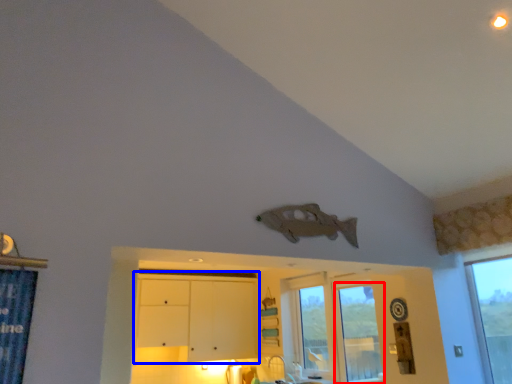
Question: Which object appears closest to the camera in this image, window (highlighted by a red box) or dresser (highlighted by a blue box)?

Choices:
 (A) window
 (B) dresser

Answer: (A)